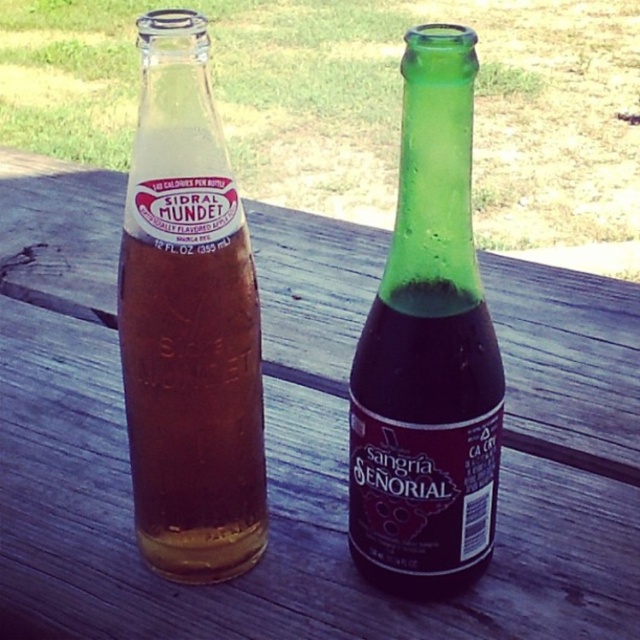
You are setting up for a picnic and have two bottles on a wooden table. You need to place a third bottle between them. The translucent glass bottle at left is at position 0.505 on the x and 0.295 on the y. Where should you place the third bottle to be exactly between them?

The third bottle should be placed at the midpoint between the translucent glass bottle at left and the other bottle. Since the coordinates of the translucent glass bottle at left are given, but the coordinates of the other bottle are not provided, it is impossible to determine the exact midpoint without additional information.